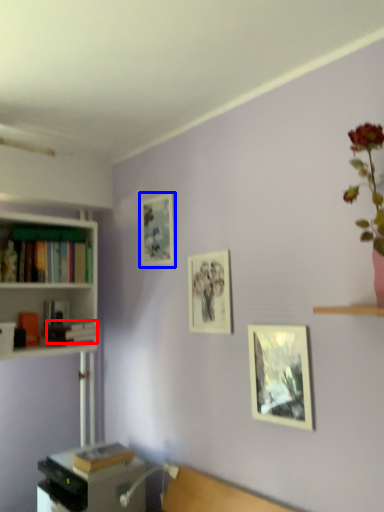
Question: Which object is closer to the camera taking this photo, book (highlighted by a red box) or picture frame (highlighted by a blue box)?

Choices:
 (A) book
 (B) picture frame

Answer: (A)